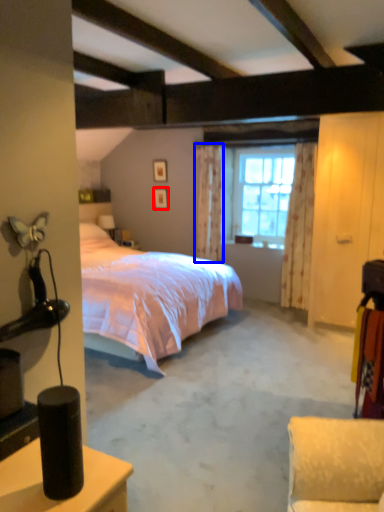
Question: Which point is further to the camera, picture frame (highlighted by a red box) or curtain (highlighted by a blue box)?

Choices:
 (A) picture frame
 (B) curtain

Answer: (A)